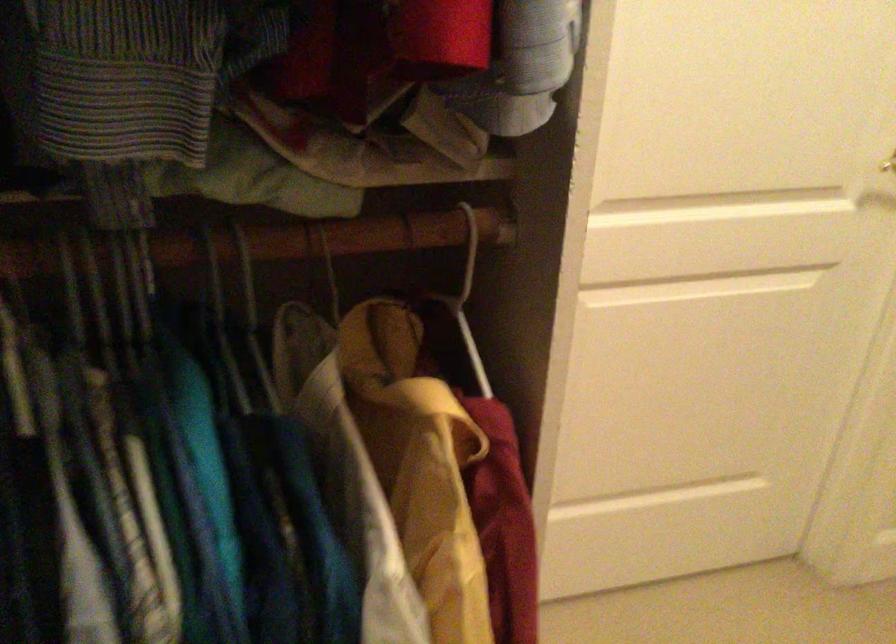
Where would you pull the gold door handle? Please return your answer as a coordinate pair (x, y).

(888, 164)